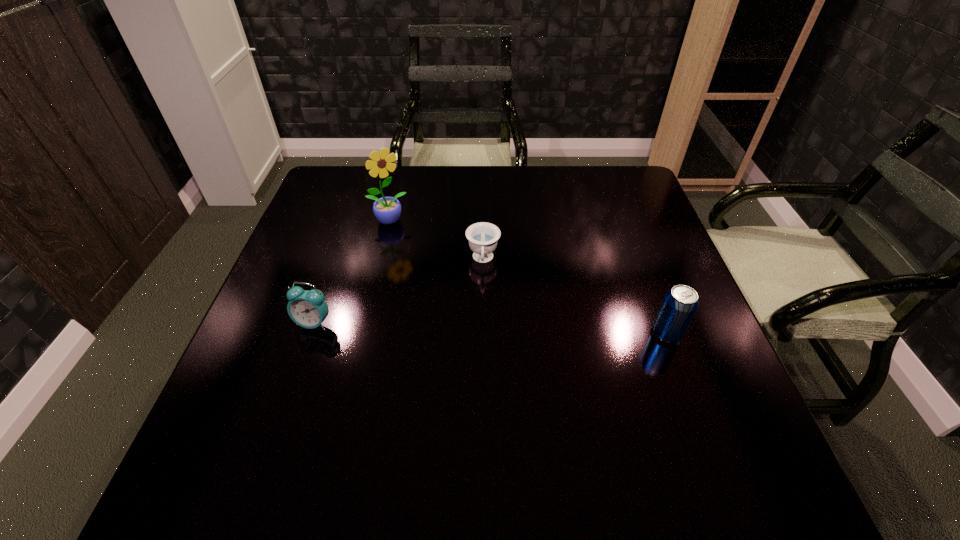
I want to click on unoccupied area between the second farthest object and the sunflower, so click(x=436, y=240).

This screenshot has height=540, width=960. I want to click on vacant region between the second object from left to right and the leftmost object, so click(x=351, y=272).

Select which object is the second closest to the second farthest object. Please provide its 2D coordinates. Your answer should be formatted as a tuple, i.e. [(x, y)], where the tuple contains the x and y coordinates of a point satisfying the conditions above.

[(308, 309)]

Find the location of `the closest object relative to the sunflower`. the closest object relative to the sunflower is located at coordinates (482, 236).